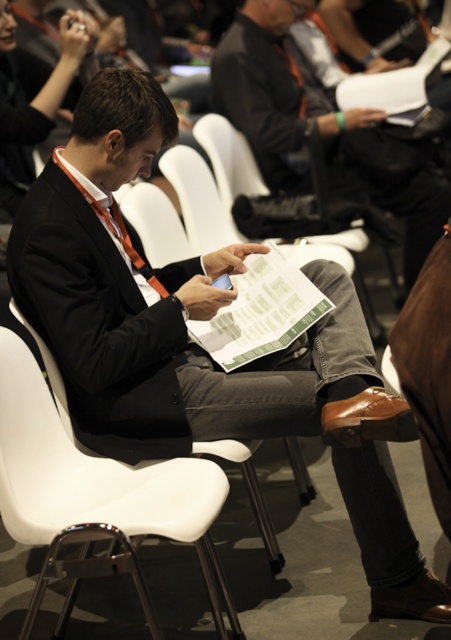
You are an event organizer trying to rearrange the seating for a presentation. The speaker will be standing behind the white plastic chair at center. Where should you position the matte black suit at center so that the speaker can see the audience clearly?

The speaker should position the matte black suit at center behind the white plastic chair at center so it doesn not block the view. Since the white plastic chair at center is in front of matte black suit at center, moving the matte black suit at center behind the chair will ensure the speaker has an unobstructed view of the audience.

You are an event organizer and need to adjust seating arrangements. If you want to move the matte black suit at center to a seat further away from the white plastic chair at center, which direction should you move it?

The white plastic chair at center is located below the matte black suit at center. To move the matte black suit at center further away from the white plastic chair at center, you should move it upwards since the chair is below the suit.